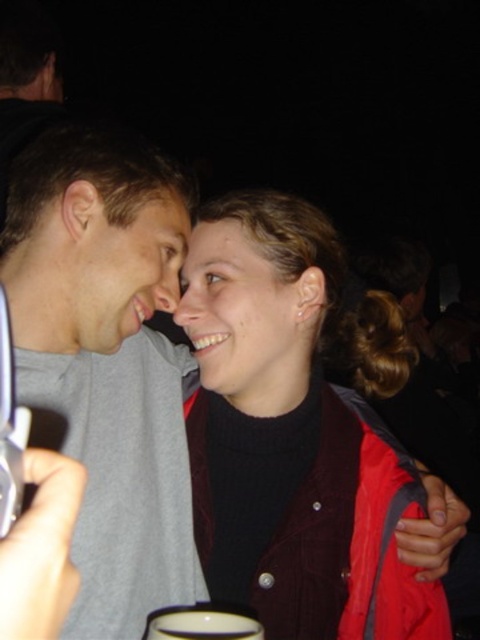
Question: Is matte black face at center above white ceramic cup at lower center?

Choices:
 (A) no
 (B) yes

Answer: (B)

Question: Can you confirm if maroon corduroy jacket at center is positioned to the left of matte black face at center?

Choices:
 (A) yes
 (B) no

Answer: (B)

Question: Which of the following is the closest to the observer?

Choices:
 (A) matte black face at center
 (B) matte gray face at center

Answer: (B)

Question: Among these points, which one is nearest to the camera?

Choices:
 (A) (212, 637)
 (B) (169, 413)
 (C) (219, 348)

Answer: (A)

Question: Observing the image, what is the correct spatial positioning of matte black face at center in reference to white ceramic cup at lower center?

Choices:
 (A) below
 (B) above

Answer: (B)

Question: Among these objects, which one is farthest from the camera?

Choices:
 (A) gray matte t-shirt at center
 (B) white ceramic cup at lower center

Answer: (A)